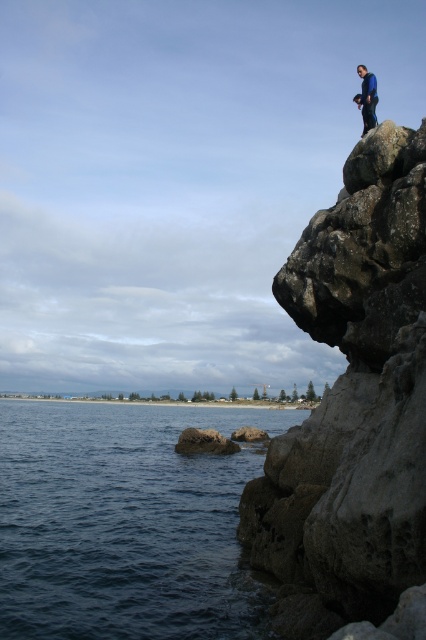
Question: Can you confirm if dark blue water at lower left is positioned below rough textured rock at lower center?

Choices:
 (A) yes
 (B) no

Answer: (A)

Question: Is dark blue water at lower left behind blue matte jacket at upper right?

Choices:
 (A) no
 (B) yes

Answer: (A)

Question: Which of these objects is positioned farthest from the dark blue water at lower left?

Choices:
 (A) rocky cliff at upper right
 (B) blue matte jacket at upper right
 (C) rough textured rock at lower center

Answer: (B)

Question: Does dark blue water at lower left have a greater width compared to rough textured rock at lower center?

Choices:
 (A) yes
 (B) no

Answer: (A)

Question: Which point is closer to the camera?

Choices:
 (A) (270, 502)
 (B) (204, 435)
 (C) (371, 113)

Answer: (A)

Question: Which point is farther from the camera taking this photo?

Choices:
 (A) (238, 449)
 (B) (357, 344)
 (C) (112, 589)
 (D) (368, 104)

Answer: (A)